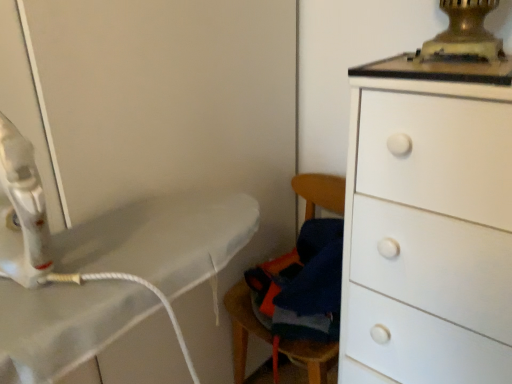
Question: From the image's perspective, is wooden swivel chair at lower center above or below white matte chest of drawers at right?

Choices:
 (A) below
 (B) above

Answer: (B)

Question: From their relative heights in the image, would you say wooden swivel chair at lower center is taller or shorter than white matte chest of drawers at right?

Choices:
 (A) short
 (B) tall

Answer: (A)

Question: Is wooden swivel chair at lower center inside or outside of white matte chest of drawers at right?

Choices:
 (A) outside
 (B) inside

Answer: (A)

Question: Looking at the image, does white matte chest of drawers at right seem bigger or smaller compared to wooden swivel chair at lower center?

Choices:
 (A) big
 (B) small

Answer: (A)

Question: In terms of width, does white matte chest of drawers at right look wider or thinner when compared to wooden swivel chair at lower center?

Choices:
 (A) thin
 (B) wide

Answer: (B)

Question: Considering the positions of white matte chest of drawers at right and wooden swivel chair at lower center in the image, is white matte chest of drawers at right taller or shorter than wooden swivel chair at lower center?

Choices:
 (A) tall
 (B) short

Answer: (A)

Question: Is white matte chest of drawers at right spatially inside wooden swivel chair at lower center, or outside of it?

Choices:
 (A) outside
 (B) inside

Answer: (A)